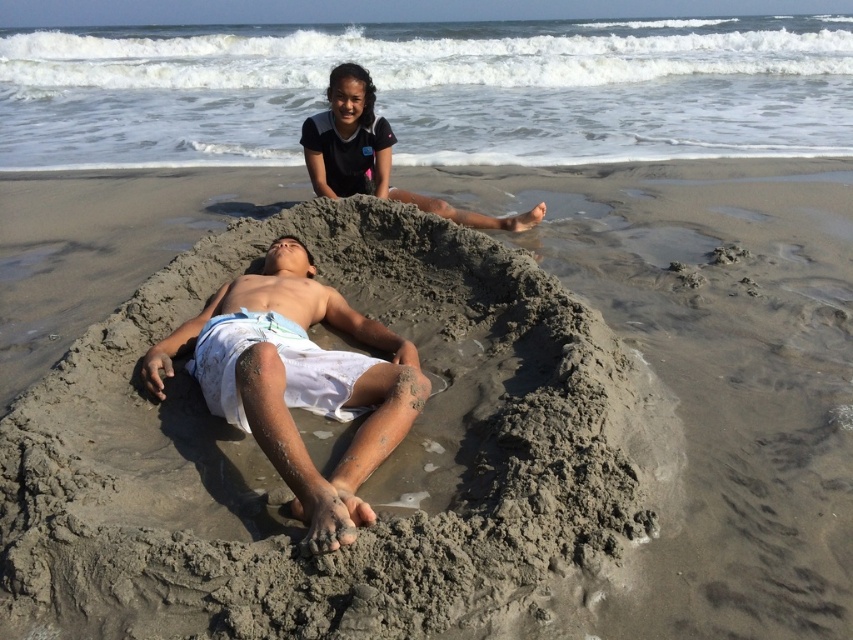
You are a photographer trying to capture a photo of the white sand man at center and the dark blue fabric at upper center in the image. To ensure both are visible in the frame, which object should you position closer to the camera?

You should position the white sand man at center closer to the camera because it is on the left side of the dark blue fabric at upper center, so moving it forward will keep both in the frame without one blocking the other.

You are a photographer at the beach scene. You need to position a camera tripod so that it can capture both the white sand man at center and the dark blue fabric at upper center in the same frame. Based on their positions, where should you place the tripod relative to these objects?

The white sand man at center is located below the dark blue fabric at upper center, so placing the tripod between them or slightly below the dark blue fabric at upper center would ensure both objects are in the frame.